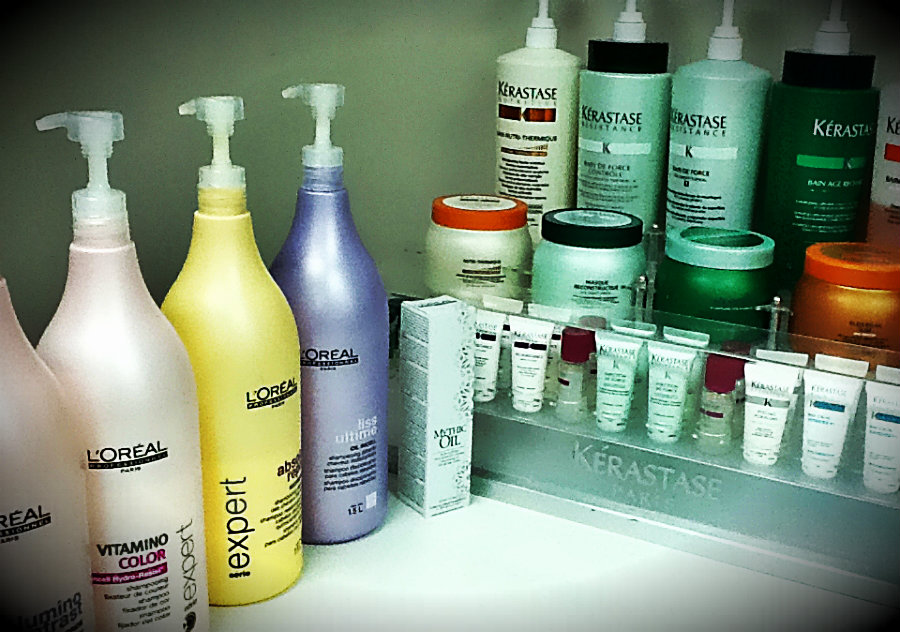
Identify the location of pump dispensers. (103, 203), (218, 174), (328, 141), (528, 40), (615, 30), (693, 45).